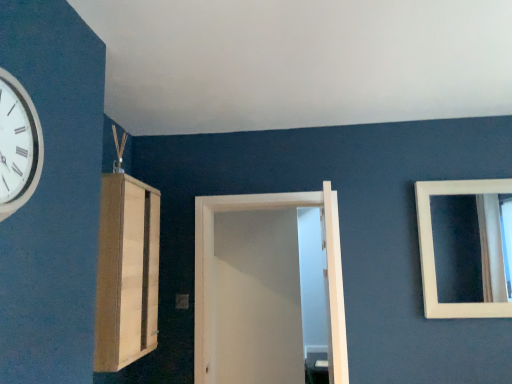
Question: Does white matte door at center touch white glossy clock at upper left?

Choices:
 (A) yes
 (B) no

Answer: (B)

Question: Is white matte door at center taller than white glossy clock at upper left?

Choices:
 (A) no
 (B) yes

Answer: (B)

Question: Can you confirm if white matte door at center is wider than white glossy clock at upper left?

Choices:
 (A) no
 (B) yes

Answer: (B)

Question: Would you say white matte door at center is outside white glossy clock at upper left?

Choices:
 (A) yes
 (B) no

Answer: (A)

Question: Can you confirm if white matte door at center is thinner than white glossy clock at upper left?

Choices:
 (A) yes
 (B) no

Answer: (B)

Question: From the image's perspective, is white glossy clock at upper left located above or below white matte mirror at upper right?

Choices:
 (A) below
 (B) above

Answer: (B)

Question: Is white glossy clock at upper left situated inside white matte mirror at upper right or outside?

Choices:
 (A) outside
 (B) inside

Answer: (A)

Question: In the image, is white glossy clock at upper left positioned in front of or behind white matte mirror at upper right?

Choices:
 (A) behind
 (B) front

Answer: (B)

Question: In terms of width, does white glossy clock at upper left look wider or thinner when compared to white matte mirror at upper right?

Choices:
 (A) wide
 (B) thin

Answer: (A)

Question: Based on their sizes in the image, would you say white matte door at center is bigger or smaller than light wood cabinet at left?

Choices:
 (A) small
 (B) big

Answer: (B)

Question: Is point (333, 294) positioned closer to the camera than point (117, 281)?

Choices:
 (A) farther
 (B) closer

Answer: (B)

Question: From the image's perspective, is white matte door at center located above or below light wood cabinet at left?

Choices:
 (A) below
 (B) above

Answer: (A)

Question: From a real-world perspective, relative to light wood cabinet at left, is white matte door at center vertically above or below?

Choices:
 (A) above
 (B) below

Answer: (B)

Question: In the image, is white matte door at center positioned in front of or behind white glossy clock at upper left?

Choices:
 (A) behind
 (B) front

Answer: (A)

Question: From a real-world perspective, is white matte door at center above or below white glossy clock at upper left?

Choices:
 (A) below
 (B) above

Answer: (A)